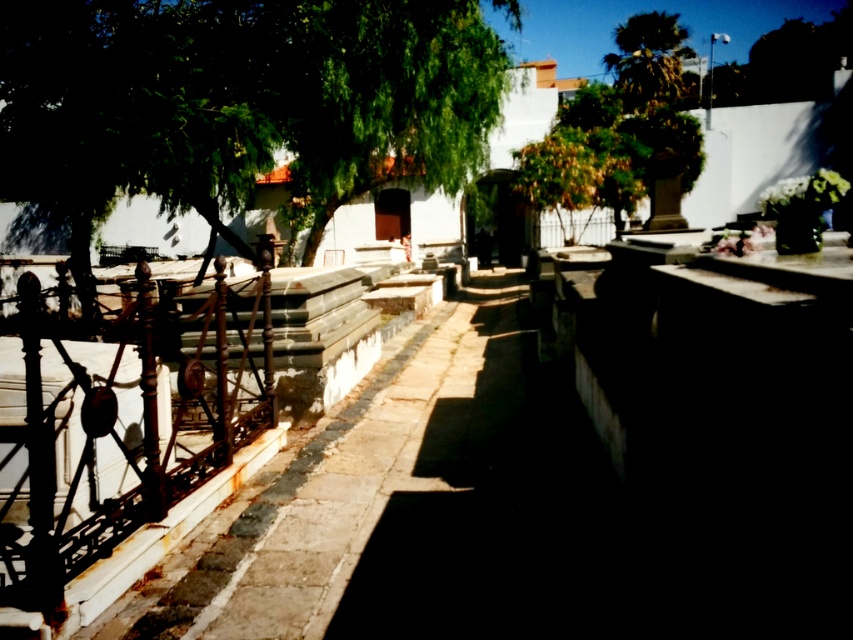
You are standing at the entrance of the cemetery and notice the rusty metal rail at left. Based on its coordinates, is it closer to the top or bottom edge of the image?

The rusty metal rail at left is located at point [122,442]. Since the y coordinate is 0.144, which is closer to 0, it is closer to the bottom edge of the image.

You are a landscape architect designing a new section for the cemetery. You need to place a new bench between the rusty metal rail at left and the green leafy tree at upper right. Which object should the bench be closer to if you want it to be near the narrower structure?

The bench should be placed closer to the rusty metal rail at left because it has a lesser width compared to the green leafy tree at upper right.